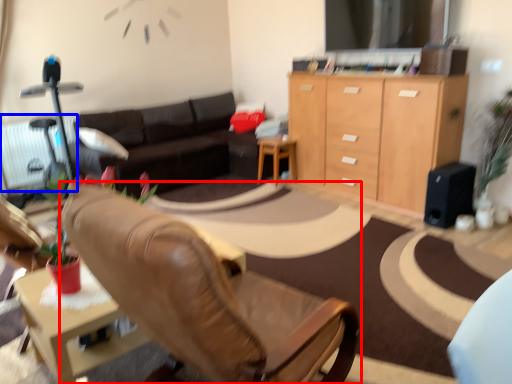
Question: Which object appears farthest to the camera in this image, chair (highlighted by a red box) or radiator (highlighted by a blue box)?

Choices:
 (A) chair
 (B) radiator

Answer: (B)